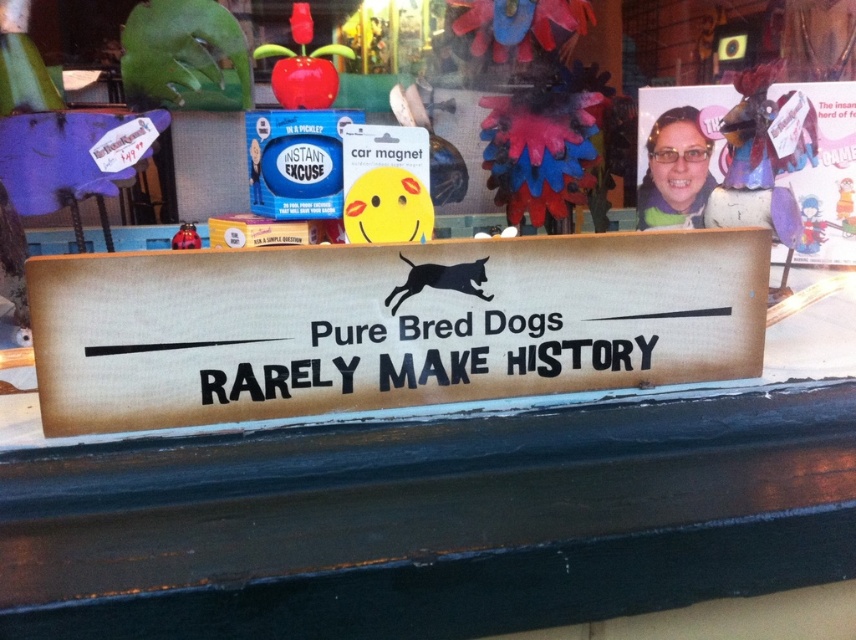
Question: Among these objects, which one is nearest to the camera?

Choices:
 (A) matte plastic photo at upper right
 (B) wooden signboard at center

Answer: (B)

Question: Which object is positioned farthest from the matte plastic photo at upper right?

Choices:
 (A) wooden signboard at center
 (B) black wood sign at center

Answer: (B)

Question: Is matte plastic photo at upper right below black wood sign at center?

Choices:
 (A) yes
 (B) no

Answer: (B)

Question: Which of these objects is positioned closest to the matte plastic photo at upper right?

Choices:
 (A) wooden signboard at center
 (B) black wood sign at center

Answer: (A)

Question: Does matte plastic photo at upper right have a greater width compared to black wood sign at center?

Choices:
 (A) no
 (B) yes

Answer: (A)

Question: Does wooden signboard at center appear under black wood sign at center?

Choices:
 (A) yes
 (B) no

Answer: (B)